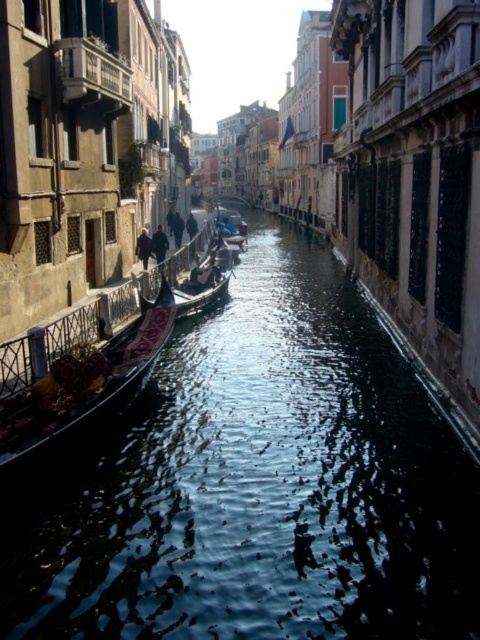
Question: Is the position of clear water at center more distant than that of black polished gondola at left?

Choices:
 (A) no
 (B) yes

Answer: (A)

Question: Among these objects, which one is nearest to the camera?

Choices:
 (A) black polished gondola at left
 (B) clear water at center

Answer: (B)

Question: Can you confirm if clear water at center is smaller than black polished gondola at left?

Choices:
 (A) yes
 (B) no

Answer: (B)

Question: Which point appears closest to the camera in this image?

Choices:
 (A) (227, 428)
 (B) (32, 432)

Answer: (B)

Question: Is clear water at center wider than black polished gondola at left?

Choices:
 (A) yes
 (B) no

Answer: (A)